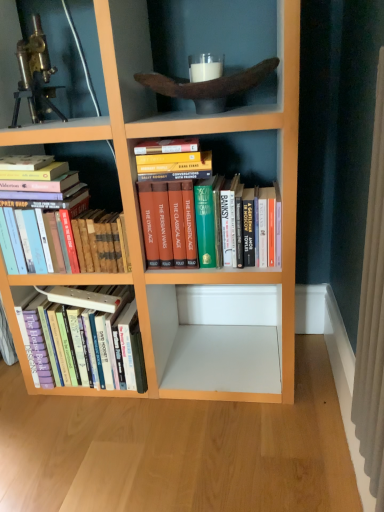
Question: Is hardcover books at left, which is the second book in top-to-bottom order, to the left or to the right of hardcover books at left, the 1th book ordered from the bottom, in the image?

Choices:
 (A) left
 (B) right

Answer: (A)

Question: From the image's perspective, relative to hardcover books at left, the third book from the top, is hardcover books at left, the second book in the bottom-to-top sequence, above or below?

Choices:
 (A) above
 (B) below

Answer: (A)

Question: Which object is positioned farthest from the hardcover books at left, which is the second book in top-to-bottom order?

Choices:
 (A) brass metallic telescope at upper left
 (B) hardcover books at center, which is the third book in bottom-to-top order
 (C) hardcover books at left, the third book from the top

Answer: (A)

Question: Estimate the real-world distances between objects in this image. Which object is farther from the hardcover books at left, the 1th book ordered from the bottom?

Choices:
 (A) brass metallic telescope at upper left
 (B) hardcover books at left, which is the second book in top-to-bottom order
 (C) hardcover books at center, which is the 1th book from top to bottom

Answer: (A)